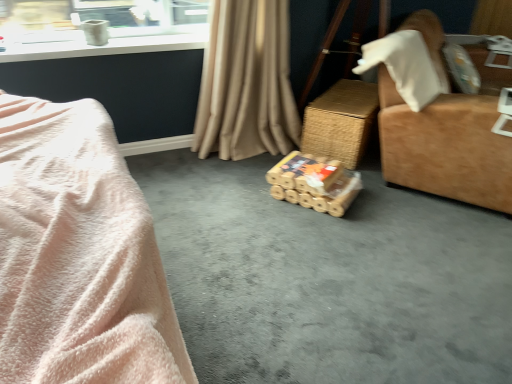
The image size is (512, 384). I want to click on vacant space in front of beige fabric curtain at center, so click(x=230, y=187).